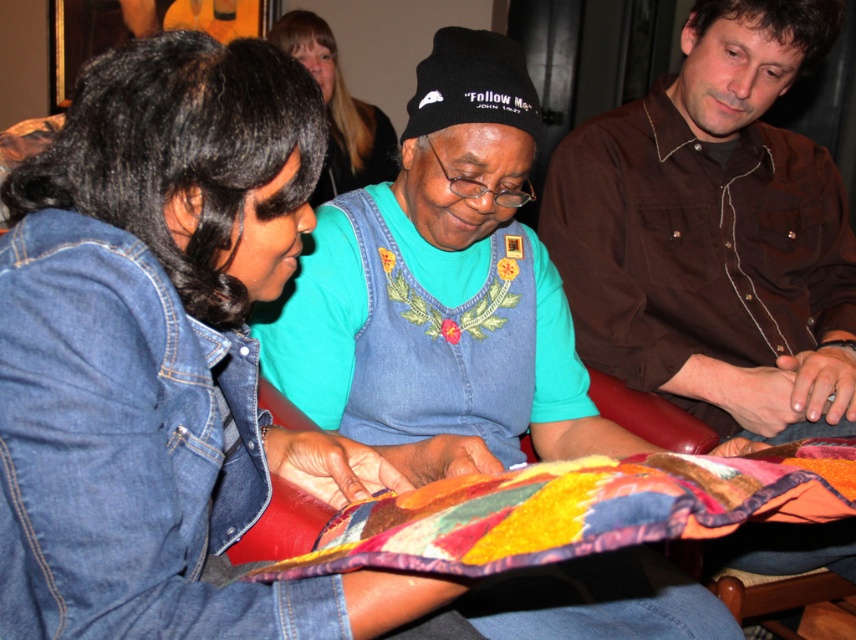
You are a photographer trying to capture a candid shot of the two main participants in the crafting activity. The camera you are using has a lens that can only focus on objects within a 1.2 meter width. Given that the brown textured shirt at center right is wider than the denim jacket at center, can you fit both subjects into the frame without cropping either of their shirts?

The brown textured shirt at center right is wider than the denim jacket at center. Since the total width of both shirts combined exceeds the camera lens width of 1.2 meters, you cannot fit both subjects into the frame without cropping at least one of their shirts.

You are standing in front of the image and want to locate the brushed denim jacket at lower left. What are its coordinates?

The coordinates of the brushed denim jacket at lower left are at point (164, 356).

You are a photographer standing in front of the scene. You want to take a photo that includes both the brushed denim jacket at lower left and the denim jacket at center. Which jacket should you focus on first to ensure both are in frame?

You should focus on the brushed denim jacket at lower left first because it is closer to the viewer than the denim jacket at center, so adjusting the camera to include both would require starting with the closer one.